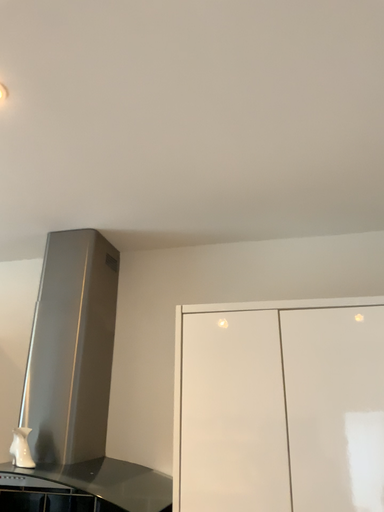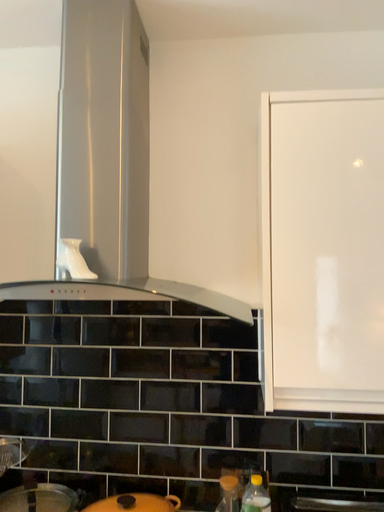
Question: How did the camera likely rotate when shooting the video?

Choices:
 (A) rotated right
 (B) rotated left

Answer: (A)